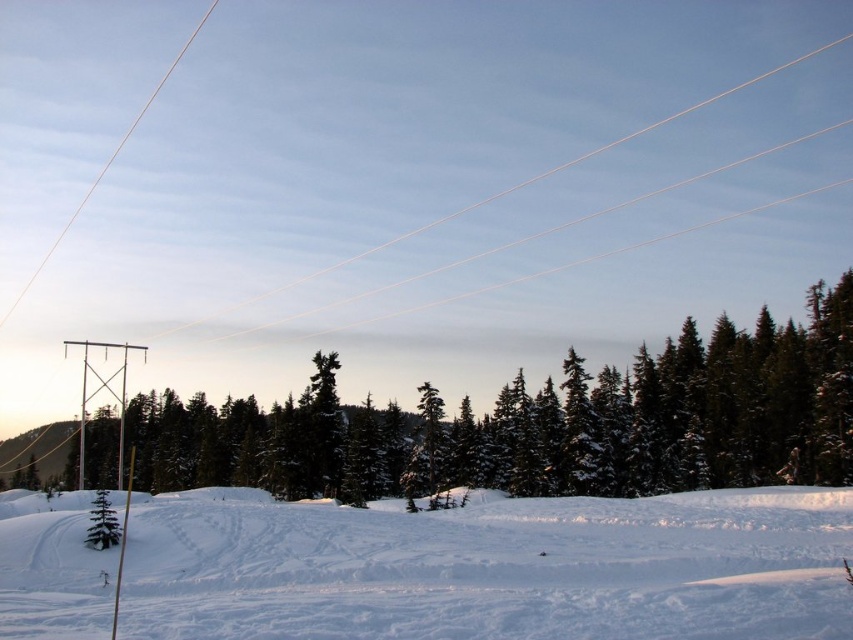
You are a photographer standing in the snow and want to capture a photo that includes both the green matte tree at center and the white wire at upper left. Which object should you adjust your camera angle to include first if you need to pan from left to right?

You should first include the white wire at upper left in your camera angle since it is located to the left of the green matte tree at center.

You are a hiker who wants to take a shortcut through the white powdery snow at lower center and the green matte tree at lower left. Which path is closer to the ground?

The white powdery snow at lower center is below green matte tree at lower left, so the path through the white powdery snow at lower center is closer to the ground.

You are standing at the point marked as point (492, 568) in the winter landscape image. What is the terrain like at your current location?

The white powdery snow at lower center is located at point (492, 568), so the terrain at your current location is covered in white powdery snow.